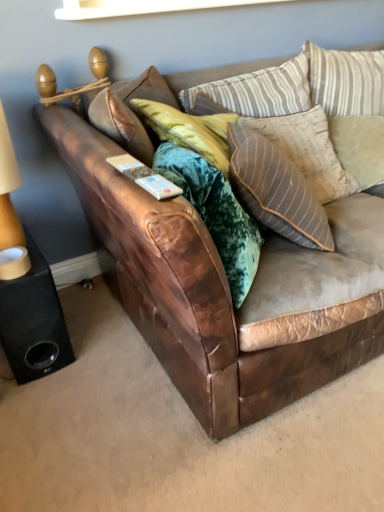
Question: Can you see beige textured pillow at upper right, arranged as the 1th pillow when viewed from the right, touching black matte speaker at lower left?

Choices:
 (A) no
 (B) yes

Answer: (A)

Question: Is black matte speaker at lower left surrounded by beige textured pillow at upper right, arranged as the 1th pillow when viewed from the right?

Choices:
 (A) yes
 (B) no

Answer: (B)

Question: Is beige textured pillow at upper right, arranged as the 1th pillow when viewed from the right, smaller than black matte speaker at lower left?

Choices:
 (A) yes
 (B) no

Answer: (A)

Question: Is beige textured pillow at upper right, arranged as the 1th pillow when viewed from the right, not near black matte speaker at lower left?

Choices:
 (A) no
 (B) yes

Answer: (B)

Question: Is beige textured pillow at upper right, the third pillow from the left, behind black matte speaker at lower left?

Choices:
 (A) no
 (B) yes

Answer: (B)

Question: From the image's perspective, is striped fabric pillow at upper right, the 2th pillow in the left-to-right sequence, above or below beige textured pillow at upper right, the third pillow from the left?

Choices:
 (A) below
 (B) above

Answer: (A)

Question: Is striped fabric pillow at upper right, placed as the 2th pillow when sorted from right to left, to the left or to the right of beige textured pillow at upper right, the third pillow from the left, in the image?

Choices:
 (A) right
 (B) left

Answer: (B)

Question: From their relative heights in the image, would you say striped fabric pillow at upper right, the 2th pillow in the left-to-right sequence, is taller or shorter than beige textured pillow at upper right, the third pillow from the left?

Choices:
 (A) tall
 (B) short

Answer: (A)

Question: In the image, is striped fabric pillow at upper right, placed as the 2th pillow when sorted from right to left, positioned in front of or behind beige textured pillow at upper right, arranged as the 1th pillow when viewed from the right?

Choices:
 (A) behind
 (B) front

Answer: (B)

Question: Based on their positions, is striped fabric pillow at upper right, placed as the 2th pillow when sorted from right to left, located to the left or right of beige fabric lampshade at left?

Choices:
 (A) left
 (B) right

Answer: (B)

Question: Is point (291, 134) positioned closer to the camera than point (16, 220)?

Choices:
 (A) farther
 (B) closer

Answer: (A)

Question: Based on their sizes in the image, would you say striped fabric pillow at upper right, placed as the 2th pillow when sorted from right to left, is bigger or smaller than beige fabric lampshade at left?

Choices:
 (A) big
 (B) small

Answer: (A)

Question: From the image's perspective, is striped fabric pillow at upper right, the 2th pillow in the left-to-right sequence, positioned above or below beige fabric lampshade at left?

Choices:
 (A) above
 (B) below

Answer: (A)

Question: Based on their sizes in the image, would you say black matte speaker at lower left is bigger or smaller than brown leather couch at center?

Choices:
 (A) big
 (B) small

Answer: (B)

Question: Looking at their shapes, would you say black matte speaker at lower left is wider or thinner than brown leather couch at center?

Choices:
 (A) wide
 (B) thin

Answer: (B)